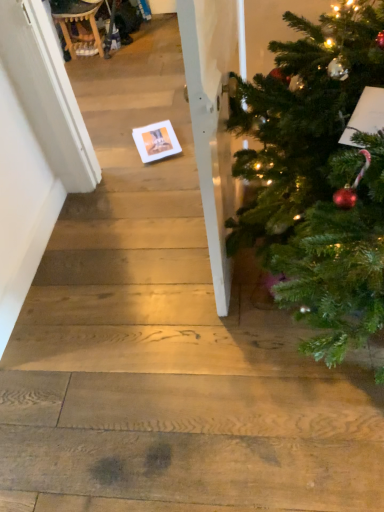
Question: Considering their positions, is wooden rocking chair at upper left located in front of or behind white matte card at center?

Choices:
 (A) front
 (B) behind

Answer: (B)

Question: Visually, is wooden rocking chair at upper left positioned to the left or to the right of white matte card at center?

Choices:
 (A) left
 (B) right

Answer: (A)

Question: Is point (84, 33) positioned closer to the camera than point (167, 119)?

Choices:
 (A) closer
 (B) farther

Answer: (B)

Question: Considering their positions, is white matte card at center located in front of or behind wooden rocking chair at upper left?

Choices:
 (A) behind
 (B) front

Answer: (B)

Question: Based on their sizes in the image, would you say white matte card at center is bigger or smaller than wooden rocking chair at upper left?

Choices:
 (A) big
 (B) small

Answer: (B)

Question: Is white matte card at center inside the boundaries of wooden rocking chair at upper left, or outside?

Choices:
 (A) outside
 (B) inside

Answer: (A)

Question: From the image's perspective, is white matte card at center located above or below wooden rocking chair at upper left?

Choices:
 (A) below
 (B) above

Answer: (A)